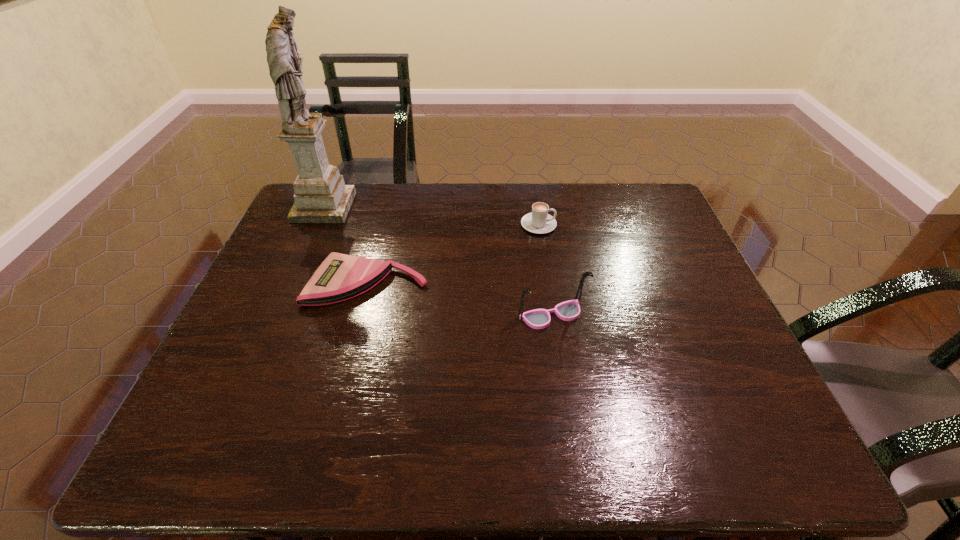
Identify the location of free space between the third shortest object and the cappuccino. This screenshot has width=960, height=540. (545, 270).

Find the location of a particular element. The height and width of the screenshot is (540, 960). free area in between the third shortest object and the shortest object is located at coordinates (460, 299).

Locate an element on the screen. This screenshot has width=960, height=540. vacant region between the sculpture and the second tallest object is located at coordinates (438, 261).

This screenshot has width=960, height=540. I want to click on free space between the sculpture and the third shortest object, so click(x=438, y=261).

Find the location of a particular element. This screenshot has width=960, height=540. free space between the wristlet and the third tallest object is located at coordinates (453, 254).

Locate an element on the screen. Image resolution: width=960 pixels, height=540 pixels. empty space between the shortest object and the sculpture is located at coordinates (346, 245).

Find the location of a particular element. The image size is (960, 540). free space between the spectacles and the shortest object is located at coordinates (460, 299).

Identify the location of vacant area that lies between the spectacles and the second shortest object. (545, 270).

Select which object is the third closest to the spectacles. Please provide its 2D coordinates. Your answer should be formatted as a tuple, i.e. [(x, y)], where the tuple contains the x and y coordinates of a point satisfying the conditions above.

[(321, 196)]

Where is `object that is the second closest one to the third tallest object`? Image resolution: width=960 pixels, height=540 pixels. object that is the second closest one to the third tallest object is located at coordinates (340, 277).